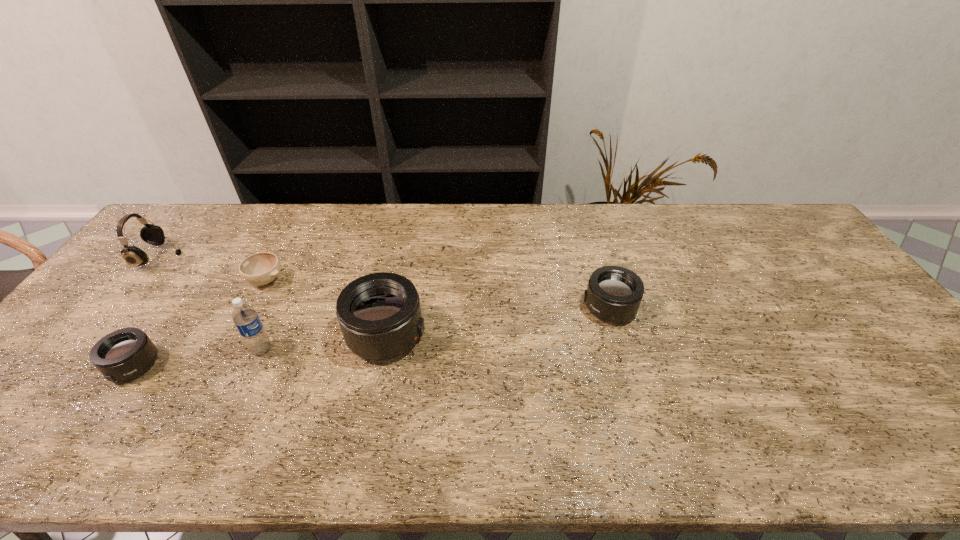
The image size is (960, 540). Identify the location of vacant place for an extra telephoto lens on the right. (808, 284).